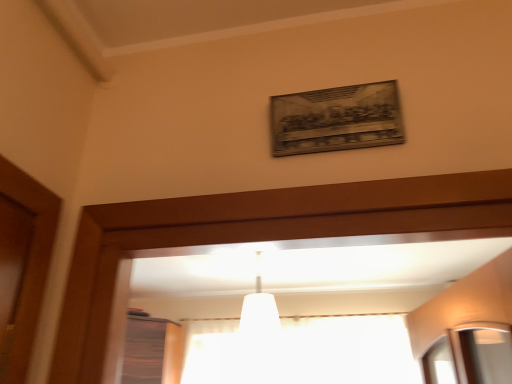
Question: From a real-world perspective, is white matte lampshade at center positioned above or below white fabric curtain at center?

Choices:
 (A) above
 (B) below

Answer: (A)

Question: Is white matte lampshade at center to the left or to the right of white fabric curtain at center in the image?

Choices:
 (A) right
 (B) left

Answer: (B)

Question: In terms of width, does white matte lampshade at center look wider or thinner when compared to white fabric curtain at center?

Choices:
 (A) wide
 (B) thin

Answer: (A)

Question: Is white fabric curtain at center taller or shorter than white matte lampshade at center?

Choices:
 (A) short
 (B) tall

Answer: (A)

Question: From a real-world perspective, relative to white matte lampshade at center, is white fabric curtain at center vertically above or below?

Choices:
 (A) above
 (B) below

Answer: (B)

Question: Considering the positions of point (205, 337) and point (271, 312), is point (205, 337) closer or farther from the camera than point (271, 312)?

Choices:
 (A) farther
 (B) closer

Answer: (A)

Question: Is white fabric curtain at center bigger or smaller than white matte lampshade at center?

Choices:
 (A) small
 (B) big

Answer: (B)